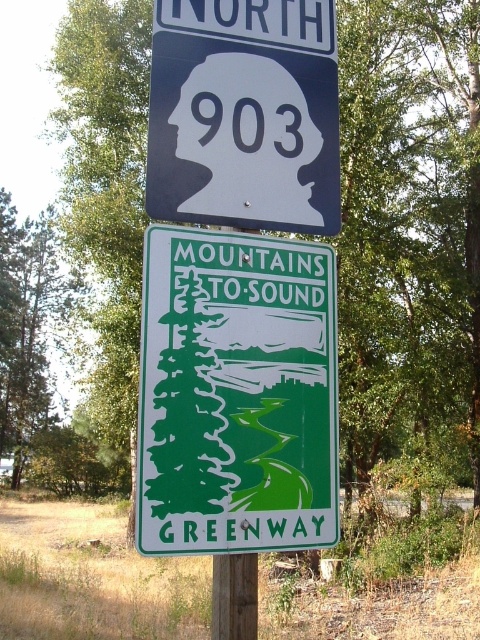
Question: Can you confirm if green matte sign at center is positioned below matte blue sign at upper center?

Choices:
 (A) yes
 (B) no

Answer: (A)

Question: Is green matte sign at center further to camera compared to matte blue sign at upper center?

Choices:
 (A) no
 (B) yes

Answer: (A)

Question: Which object appears farthest from the camera in this image?

Choices:
 (A) green matte sign at center
 (B) matte blue sign at upper center

Answer: (B)

Question: Does green matte sign at center appear over matte blue sign at upper center?

Choices:
 (A) yes
 (B) no

Answer: (B)